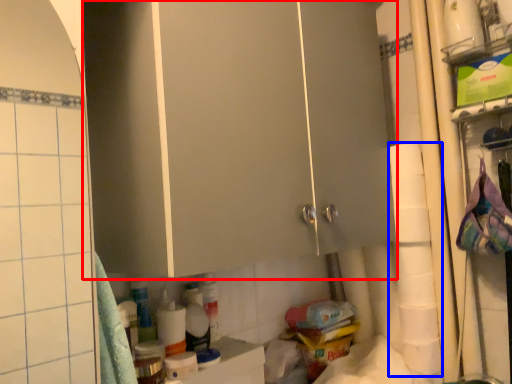
Question: Which point is further to the camera, cabinetry (highlighted by a red box) or toilet paper (highlighted by a blue box)?

Choices:
 (A) cabinetry
 (B) toilet paper

Answer: (B)